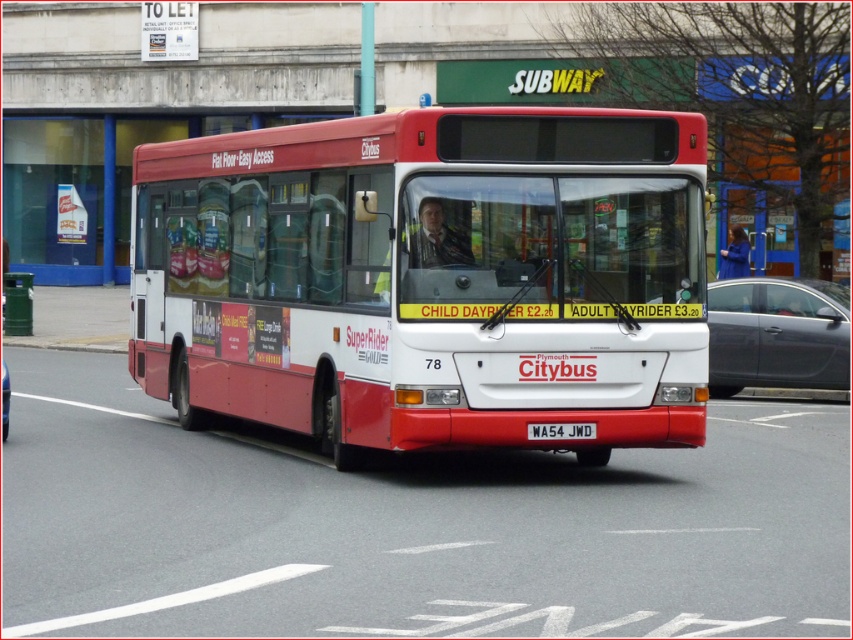
You are a city planner analyzing traffic flow. You observe a matte red bus at center and a metallic gray sedan at center. Which vehicle has a wider body?

The metallic gray sedan at center has a wider body than the matte red bus at center.

You are a pedestrian standing at the crosswalk and see both the metallic gray sedan at center and the metallic gray car at center. Which one is more to the right?

The metallic gray sedan at center is positioned on the right side of the metallic gray car at center, so the metallic gray sedan at center is more to the right.